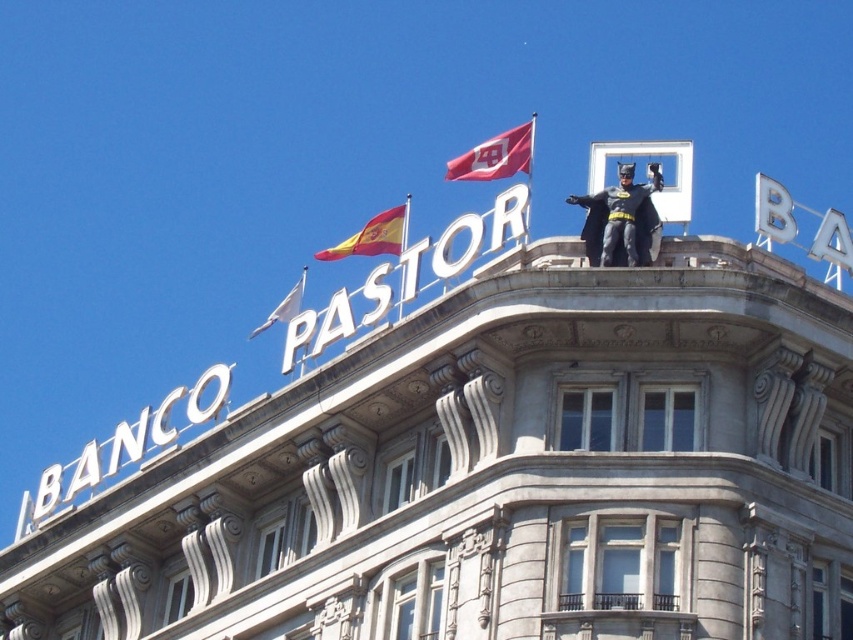
Question: Can you confirm if smooth black costume at upper center is wider than white fabric flag at upper center?

Choices:
 (A) yes
 (B) no

Answer: (B)

Question: Considering the relative positions of smooth black costume at upper center and yellow-red striped fabric at upper center in the image provided, where is smooth black costume at upper center located with respect to yellow-red striped fabric at upper center?

Choices:
 (A) right
 (B) left

Answer: (A)

Question: Which of the following is the closest to the observer?

Choices:
 (A) red fabric flag at upper center
 (B) yellow-red striped fabric at upper center
 (C) white fabric flag at upper center
 (D) smooth black costume at upper center

Answer: (D)

Question: Does smooth black costume at upper center appear over red fabric flag at upper center?

Choices:
 (A) yes
 (B) no

Answer: (B)

Question: Among these objects, which one is nearest to the camera?

Choices:
 (A) yellow-red striped fabric at upper center
 (B) smooth black costume at upper center
 (C) red fabric flag at upper center

Answer: (B)

Question: Among these objects, which one is nearest to the camera?

Choices:
 (A) red fabric flag at upper center
 (B) white fabric flag at upper center
 (C) yellow-red striped fabric at upper center

Answer: (A)